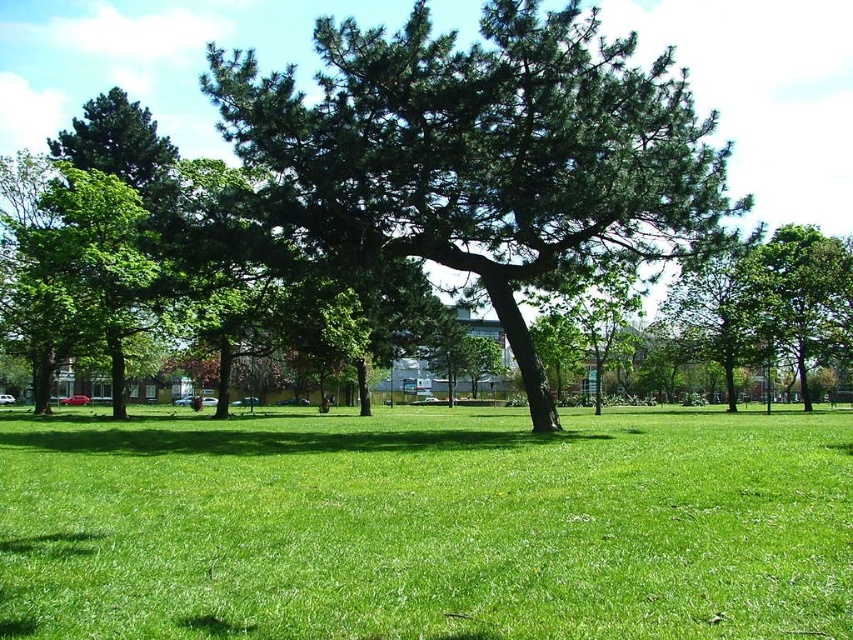
Does point (828, 556) come closer to viewer compared to point (465, 259)?

Yes, it is in front of point (465, 259).

Can you confirm if green grassy field at center is positioned to the right of green leafy tree at center?

Incorrect, green grassy field at center is not on the right side of green leafy tree at center.

Image resolution: width=853 pixels, height=640 pixels. What do you see at coordinates (427, 525) in the screenshot?
I see `green grassy field at center` at bounding box center [427, 525].

Find the location of a particular element. green grassy field at center is located at coordinates (427, 525).